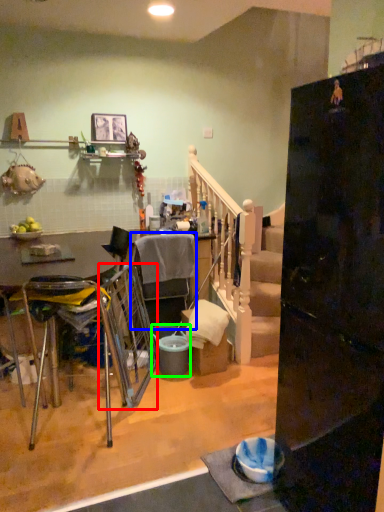
Question: Which object is the closest to the swivel chair (highlighted by a red box)? Choose among these: chair (highlighted by a blue box) or bucket (highlighted by a green box).

Choices:
 (A) chair
 (B) bucket

Answer: (B)